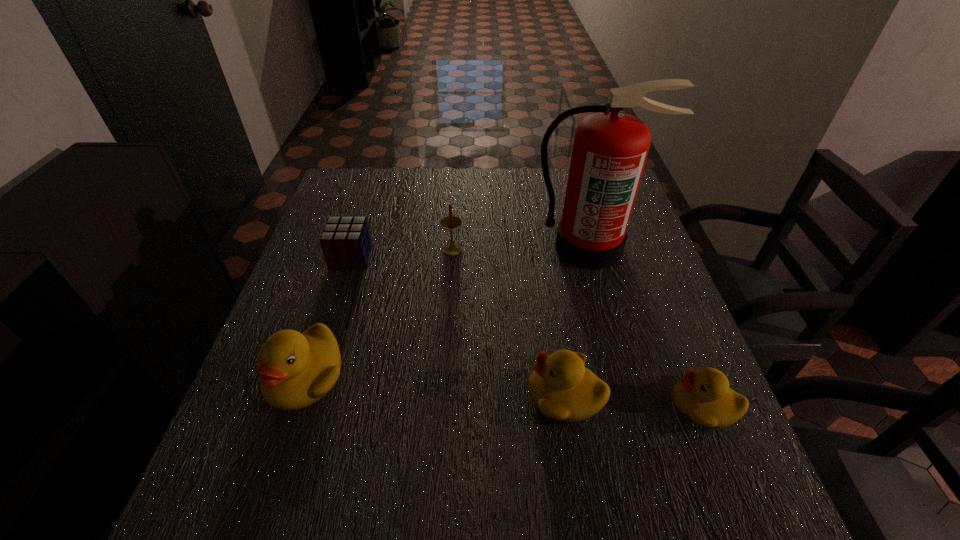
Locate an element on the screen. Image resolution: width=960 pixels, height=540 pixels. fire extinguisher present at the right edge is located at coordinates (610, 148).

Image resolution: width=960 pixels, height=540 pixels. I want to click on object at the near left corner, so click(x=296, y=369).

Identify the location of object located at the near right corner. (703, 397).

In the image, there is a desktop. At what (x,y) coordinates should I click in order to perform the action: click on vacant space at the far edge. Please return your answer as a coordinate pair (x, y). The height and width of the screenshot is (540, 960). Looking at the image, I should click on (539, 170).

Locate an element on the screen. free space at the near edge of the desktop is located at coordinates (416, 457).

What are the coordinates of `free space at the left edge` in the screenshot? It's located at (330, 214).

What are the coordinates of `vacant point at the right edge` in the screenshot? It's located at (633, 241).

You are a GUI agent. You are given a task and a screenshot of the screen. Output one action in this format:
    pyautogui.click(x=<x>, y=<y>)
    Task: Click on the free space at the far left corner of the desktop
    This screenshot has height=540, width=960.
    Given the screenshot: What is the action you would take?
    pyautogui.click(x=370, y=205)

Locate an element on the screen. The height and width of the screenshot is (540, 960). free space that is in between the leftmost duckling and the shortest duckling is located at coordinates (504, 390).

Where is `vacant region between the leftmost duckling and the fourth tallest object`? The height and width of the screenshot is (540, 960). vacant region between the leftmost duckling and the fourth tallest object is located at coordinates (435, 385).